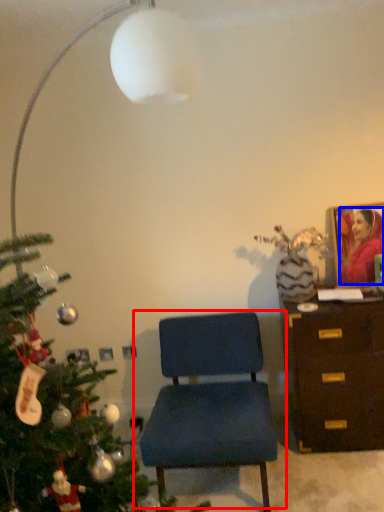
Question: Among these objects, which one is nearest to the camera, chair (highlighted by a red box) or person (highlighted by a blue box)?

Choices:
 (A) chair
 (B) person

Answer: (A)